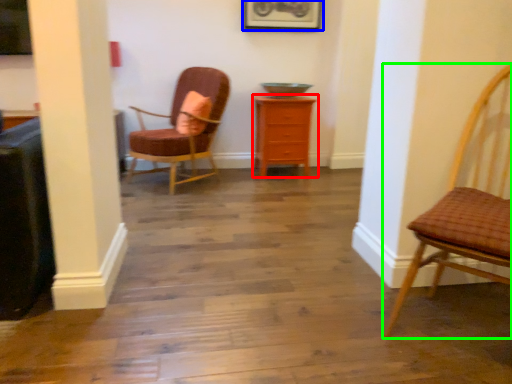
Question: Which object is the farthest from chest of drawers (highlighted by a red box)? Choose among these: picture frame (highlighted by a blue box) or chair (highlighted by a green box).

Choices:
 (A) picture frame
 (B) chair

Answer: (B)